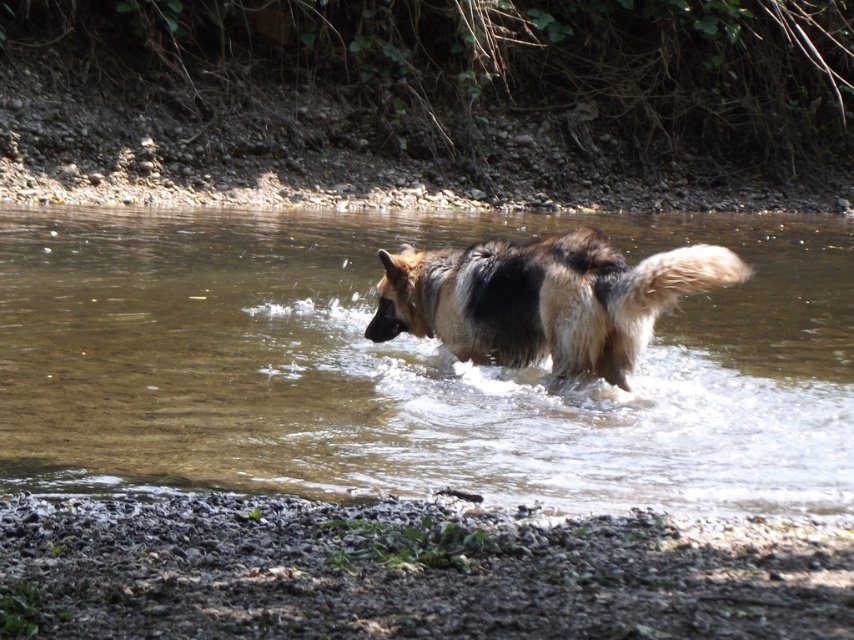
Question: Does clear water at center have a larger size compared to brown fur dog at center?

Choices:
 (A) yes
 (B) no

Answer: (A)

Question: Which point is farther to the camera?

Choices:
 (A) (427, 244)
 (B) (670, 300)

Answer: (A)

Question: Does clear water at center have a lesser width compared to brown fur dog at center?

Choices:
 (A) yes
 (B) no

Answer: (B)

Question: Which point is closer to the camera taking this photo?

Choices:
 (A) (605, 458)
 (B) (557, 236)

Answer: (A)

Question: Can you confirm if clear water at center is bigger than brown fur dog at center?

Choices:
 (A) yes
 (B) no

Answer: (A)